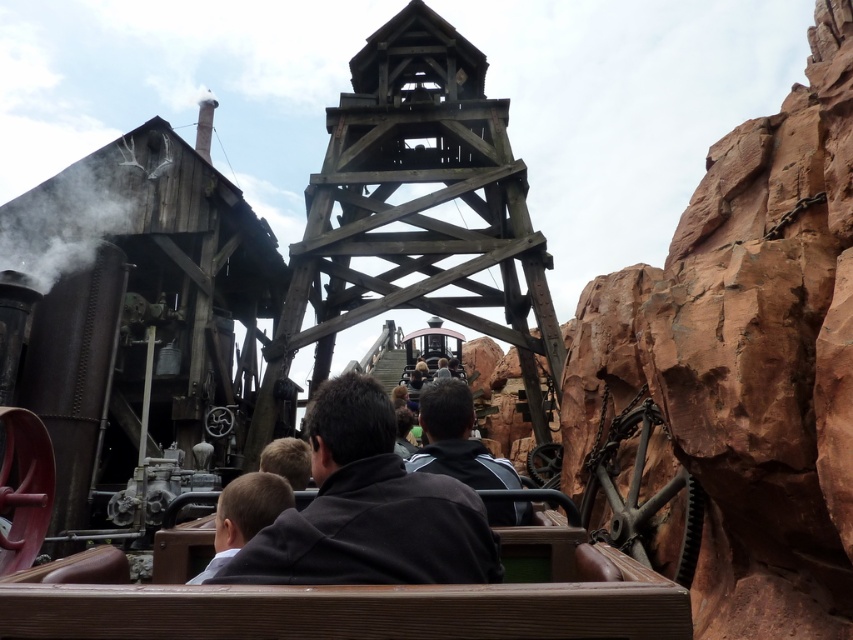
Does dark gray fabric at center have a lesser height compared to dark gray hoodie at center?

No.

Is dark gray fabric at center to the left of dark gray hoodie at center from the viewer's perspective?

Yes, dark gray fabric at center is to the left of dark gray hoodie at center.

Which is behind, point (335, 582) or point (485, 502)?

The point (485, 502) is behind.

At what (x,y) coordinates should I click in order to perform the action: click on dark gray fabric at center. Please return your answer as a coordinate pair (x, y). The height and width of the screenshot is (640, 853). Looking at the image, I should click on (368, 508).

Does wooden at center have a greater height compared to dark gray fabric at center?

Indeed, wooden at center has a greater height compared to dark gray fabric at center.

Can you confirm if wooden at center is positioned to the left of dark gray fabric at center?

Incorrect, wooden at center is not on the left side of dark gray fabric at center.

Where is `wooden at center`? This screenshot has height=640, width=853. wooden at center is located at coordinates [x=415, y=212].

From the picture: Between rusty metal steam engine at left and light brown leather jacket at lower center, which one appears on the left side from the viewer's perspective?

From the viewer's perspective, rusty metal steam engine at left appears more on the left side.

Does rusty metal steam engine at left have a smaller size compared to light brown leather jacket at lower center?

No, rusty metal steam engine at left is not smaller than light brown leather jacket at lower center.

Which is in front, point (113, 291) or point (229, 483)?

Point (113, 291) is more forward.

You are a GUI agent. You are given a task and a screenshot of the screen. Output one action in this format:
    pyautogui.click(x=<x>, y=<y>)
    Task: Click on the rusty metal steam engine at left
    This screenshot has height=640, width=853.
    Given the screenshot: What is the action you would take?
    pyautogui.click(x=143, y=326)